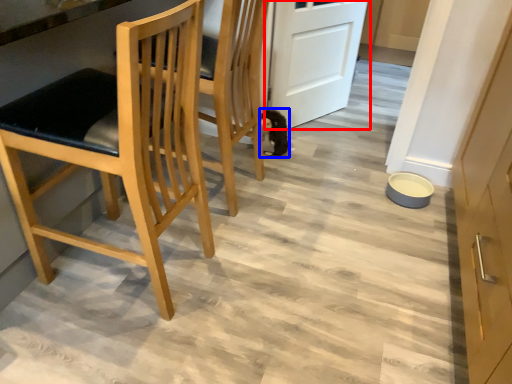
Question: Which object is closer to the camera taking this photo, door (highlighted by a red box) or animal (highlighted by a blue box)?

Choices:
 (A) door
 (B) animal

Answer: (A)